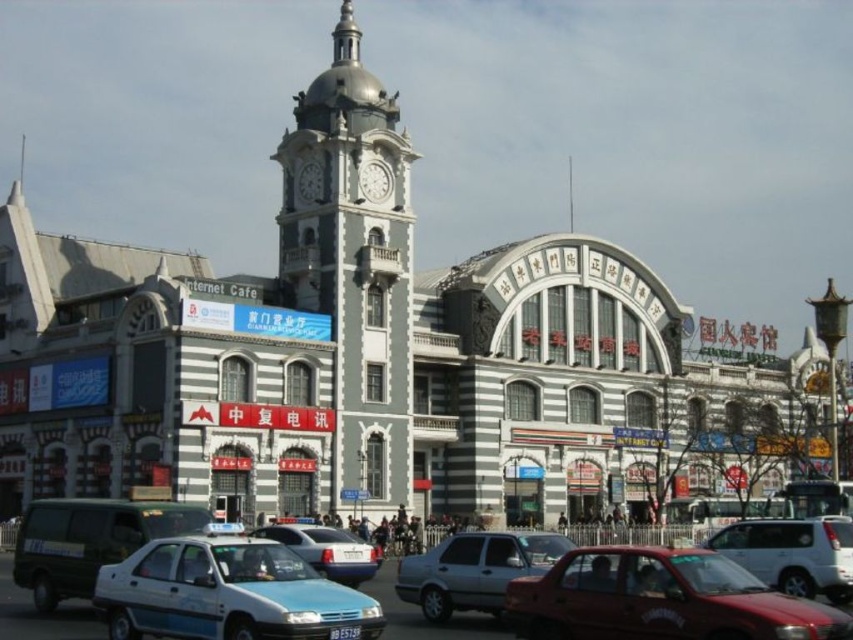
Question: Is light blue plastic car at lower center closer to camera compared to light blue metallic sedan at center?

Choices:
 (A) no
 (B) yes

Answer: (B)

Question: Which of these objects is positioned farthest from the silver metallic sedan at center?

Choices:
 (A) white metallic clock at upper center
 (B) white glossy clock at center
 (C) white glossy sedan at center

Answer: (B)

Question: Which point is farther to the camera?

Choices:
 (A) shiny red sedan at lower right
 (B) white metallic clock at upper center
 (C) white glossy sedan at center
 (D) silver metallic sedan at center

Answer: (B)

Question: Can you confirm if matte red car at lower right is positioned above white glossy clock at center?

Choices:
 (A) no
 (B) yes

Answer: (A)

Question: Which object is positioned closest to the shiny red sedan at lower right?

Choices:
 (A) white glossy sedan at center
 (B) light blue metallic sedan at center

Answer: (B)

Question: Does silver metallic clock tower at center appear on the right side of shiny red sedan at lower right?

Choices:
 (A) no
 (B) yes

Answer: (A)